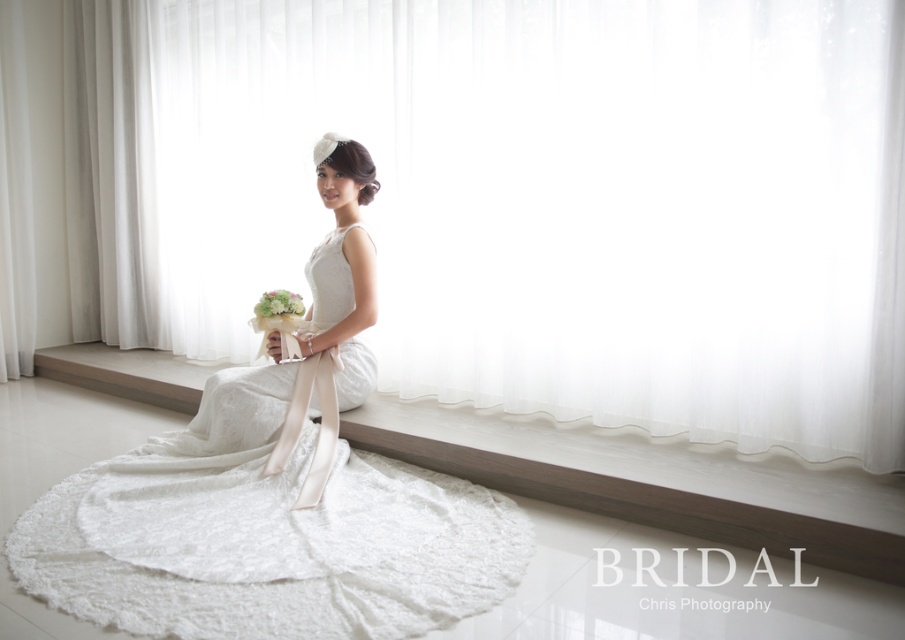
You are a photographer setting up for a bridal photoshoot. The bride is seated on a raised platform near a large window. You need to adjust the lighting so that the light from the window illuminates the bride evenly. Considering the position of the white sheer curtain at center, where should you place the curtain to achieve even lighting?

The white sheer curtain at center is positioned at point (518, 198), so placing the curtain there will diffuse the light evenly over the bride.

Looking at this image, you are a photographer adjusting your camera settings in the studio. You notice two points marked in the scene. The first point is at coordinate point (505, 198) and the second is at point (293, 298). Which point is closer to your camera lens?

Point (505, 198) is further to the viewer than point (293, 298), so the second point at (293, 298) is closer to the camera lens.

You are a photographer setting up for a bridal photoshoot. You need to place two markers at the coordinates provided. The first marker is at point [265,548] and the second at point [270,307]. Based on the scene description, which marker is closer to the bride?

Point [265,548] is in front of point [270,307], so the first marker at point [265,548] is closer to the bride.